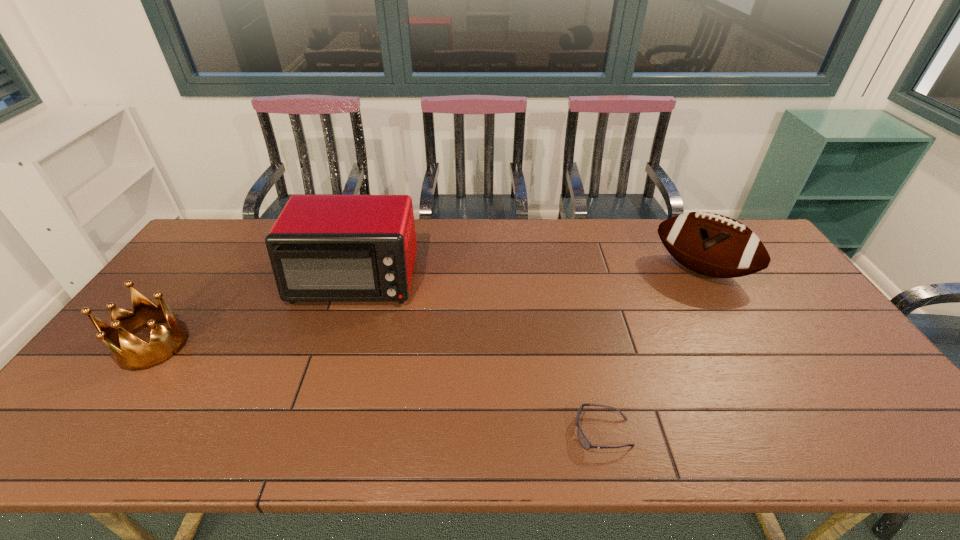
The image size is (960, 540). I want to click on toaster oven, so click(x=323, y=248).

This screenshot has width=960, height=540. What are the coordinates of `football (American)` in the screenshot? It's located at (710, 244).

Locate an element on the screen. The width and height of the screenshot is (960, 540). the second nearest object is located at coordinates (135, 354).

I want to click on the leftmost object, so click(x=135, y=354).

At what (x,y) coordinates should I click in order to perform the action: click on sunglasses. Please return your answer as a coordinate pair (x, y). The height and width of the screenshot is (540, 960). Looking at the image, I should click on (584, 442).

At what (x,y) coordinates should I click in order to perform the action: click on the nearest object. Please return your answer as a coordinate pair (x, y). The image size is (960, 540). Looking at the image, I should click on (584, 442).

Find the location of `vacant space located 0.300m on the front-facing side of the toaster oven`. vacant space located 0.300m on the front-facing side of the toaster oven is located at coordinates (315, 402).

Find the location of `vacant point located 0.240m on the left of the rightmost object`. vacant point located 0.240m on the left of the rightmost object is located at coordinates (584, 269).

Locate an element on the screen. vacant point located 0.240m on the right of the second shortest object is located at coordinates (275, 345).

Locate an element on the screen. Image resolution: width=960 pixels, height=540 pixels. vacant space located 0.330m on the lenses of the shortest object is located at coordinates (429, 432).